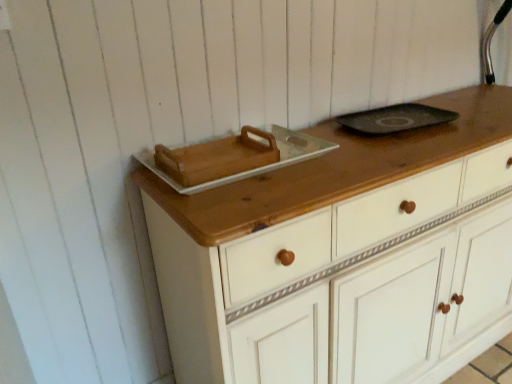
Identify the location of wooden tray at upper center. (255, 168).

Describe the element at coordinates (255, 168) in the screenshot. I see `wooden tray at upper center` at that location.

The width and height of the screenshot is (512, 384). In order to click on white painted wood chest of drawers at center in this screenshot , I will do `click(343, 256)`.

Measure the distance between point (343,206) and camera.

They are 94.90 centimeters apart.

This screenshot has height=384, width=512. What do you see at coordinates (343, 256) in the screenshot? I see `white painted wood chest of drawers at center` at bounding box center [343, 256].

You are a GUI agent. You are given a task and a screenshot of the screen. Output one action in this format:
    pyautogui.click(x=<x>, y=<y>)
    Task: Click on the wooden tray at upper center
    The width and height of the screenshot is (512, 384).
    Given the screenshot: What is the action you would take?
    pyautogui.click(x=255, y=168)

Is wooden tray at upper center to the left or to the right of white painted wood chest of drawers at center in the image?

wooden tray at upper center is to the left of white painted wood chest of drawers at center.

Is wooden tray at upper center positioned behind white painted wood chest of drawers at center?

That is True.

Does point (134, 154) come farther from viewer compared to point (365, 277)?

Yes.

From the image's perspective, which object appears higher, wooden tray at upper center or white painted wood chest of drawers at center?

wooden tray at upper center, from the image's perspective.

From a real-world perspective, is wooden tray at upper center physically below white painted wood chest of drawers at center?

No, from a real-world perspective, wooden tray at upper center is not below white painted wood chest of drawers at center.

Which object is wider, wooden tray at upper center or white painted wood chest of drawers at center?

Wider between the two is white painted wood chest of drawers at center.

Considering the sizes of wooden tray at upper center and white painted wood chest of drawers at center in the image, is wooden tray at upper center taller or shorter than white painted wood chest of drawers at center?

wooden tray at upper center is shorter than white painted wood chest of drawers at center.

Is wooden tray at upper center bigger or smaller than white painted wood chest of drawers at center?

Clearly, wooden tray at upper center is smaller in size than white painted wood chest of drawers at center.

Is wooden tray at upper center situated inside white painted wood chest of drawers at center or outside?

wooden tray at upper center exists outside the volume of white painted wood chest of drawers at center.

Is wooden tray at upper center directly adjacent to white painted wood chest of drawers at center?

wooden tray at upper center is not next to white painted wood chest of drawers at center, and they're not touching.

Is wooden tray at upper center looking in the opposite direction of white painted wood chest of drawers at center?

No, wooden tray at upper center is not facing away from white painted wood chest of drawers at center.

What are the coordinates of `the chest of drawers located underneath the wooden tray at upper center (from a real-world perspective)` in the screenshot? It's located at (343, 256).

Based on the photo, between white painted wood chest of drawers at center and wooden tray at upper center, which one appears on the right side from the viewer's perspective?

white painted wood chest of drawers at center.

Which is in front, white painted wood chest of drawers at center or wooden tray at upper center?

Positioned in front is white painted wood chest of drawers at center.

Considering the points (237, 341) and (287, 135), which point is behind, point (237, 341) or point (287, 135)?

The point (287, 135) is behind.

From the image's perspective, is white painted wood chest of drawers at center positioned above or below wooden tray at upper center?

white painted wood chest of drawers at center is below wooden tray at upper center.

From a real-world perspective, which is physically above, white painted wood chest of drawers at center or wooden tray at upper center?

wooden tray at upper center.

Considering the sizes of objects white painted wood chest of drawers at center and wooden tray at upper center in the image provided, who is wider, white painted wood chest of drawers at center or wooden tray at upper center?

Wider between the two is white painted wood chest of drawers at center.

From their relative heights in the image, would you say white painted wood chest of drawers at center is taller or shorter than wooden tray at upper center?

Clearly, white painted wood chest of drawers at center is taller compared to wooden tray at upper center.

Is white painted wood chest of drawers at center bigger or smaller than wooden tray at upper center?

Considering their sizes, white painted wood chest of drawers at center takes up more space than wooden tray at upper center.

Choose the correct answer: Is white painted wood chest of drawers at center inside wooden tray at upper center or outside it?

white painted wood chest of drawers at center is not inside wooden tray at upper center, it's outside.

Is white painted wood chest of drawers at center placed right next to wooden tray at upper center?

white painted wood chest of drawers at center and wooden tray at upper center are clearly separated.

Based on the photo, is white painted wood chest of drawers at center facing towards wooden tray at upper center?

No, white painted wood chest of drawers at center is not turned towards wooden tray at upper center.

I want to click on the chest of drawers in front of the wooden tray at upper center, so click(343, 256).

In order to click on appliance above the white painted wood chest of drawers at center (from the image's perspective) in this screenshot , I will do `click(255, 168)`.

Locate an element on the screen. The width and height of the screenshot is (512, 384). appliance on the left of white painted wood chest of drawers at center is located at coordinates (255, 168).